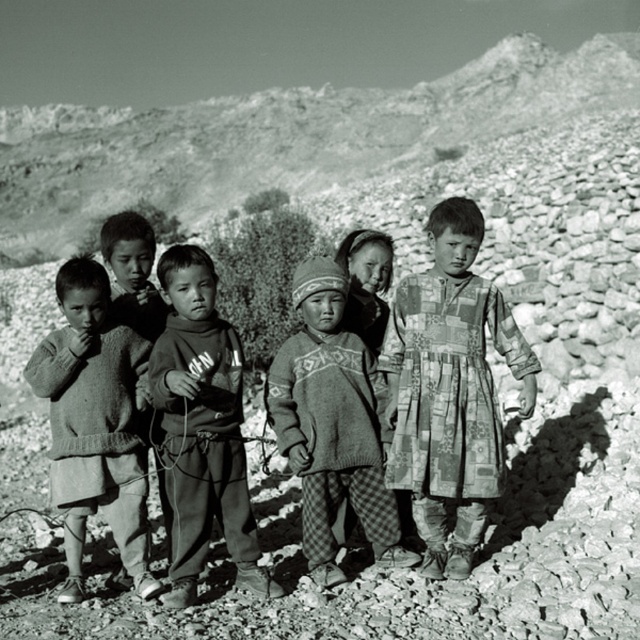
You are a photographer analyzing the composition of this black and white photo. You notice two points marked in the image at coordinates point (387, 387) and point (96, 275). Based on their positions, which point is closer to the camera?

Point (387, 387) is closer to the camera than point (96, 275) because it is further to the viewer.

You are a photographer trying to capture a new angle of the children in the scene. You want to ensure that both point [572,90] and point [132,273] are visible in your shot. Based on their positions, which point should be closer to the camera to avoid blocking the other?

Point [132,273] should be closer to the camera because point [572,90] is behind it, so positioning the camera so that point [132,273] is nearer will prevent it from blocking the other point.